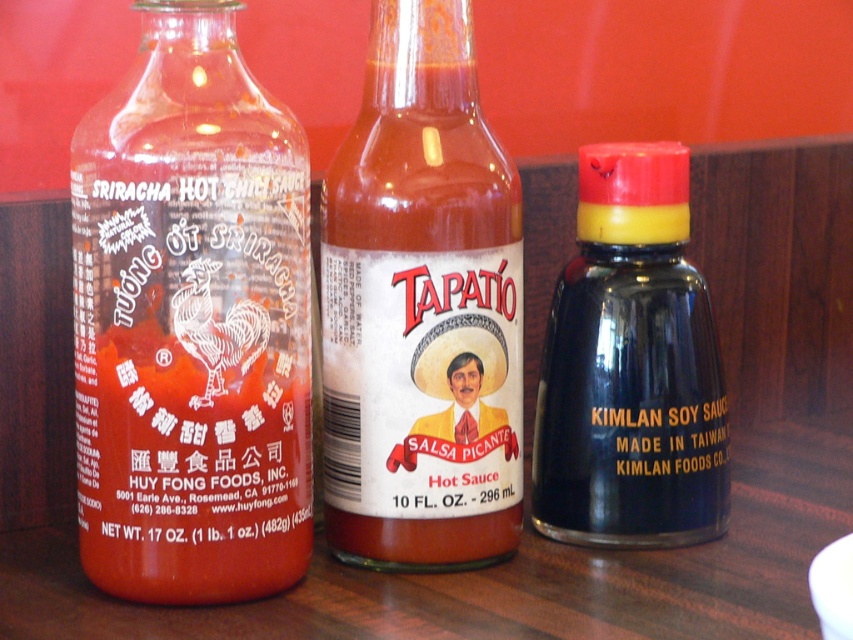
Question: Observing the image, what is the correct spatial positioning of translucent glass sriracha hot chili sauce bottle at left in reference to matte glass bottle at center?

Choices:
 (A) right
 (B) left

Answer: (B)

Question: Which point appears closest to the camera in this image?

Choices:
 (A) (659, 506)
 (B) (454, 38)
 (C) (248, 426)

Answer: (C)

Question: Does translucent glass sriracha hot chili sauce bottle at left have a lesser width compared to black matte soy sauce at center?

Choices:
 (A) no
 (B) yes

Answer: (A)

Question: Is translucent glass sriracha hot chili sauce bottle at left positioned behind black matte soy sauce at center?

Choices:
 (A) yes
 (B) no

Answer: (B)

Question: Which point appears closest to the camera in this image?

Choices:
 (A) (239, 212)
 (B) (717, 424)
 (C) (352, 273)

Answer: (A)

Question: Which point appears farthest from the camera in this image?

Choices:
 (A) (683, 397)
 (B) (437, 102)

Answer: (A)